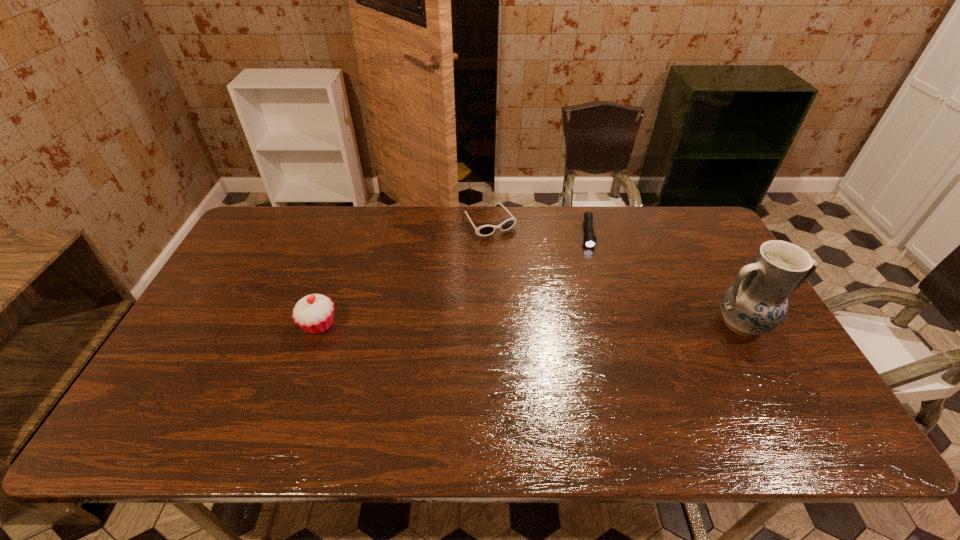
Locate an element on the screen. Image resolution: width=960 pixels, height=540 pixels. free space on the desktop that is between the cupcake and the rightmost object and is positioned with the lenses of the sunglasses facing outward is located at coordinates (565, 324).

Find the location of a particular element. vacant space on the desktop that is between the leftmost object and the tallest object and is positioned at the lens end of the flashlight is located at coordinates (593, 324).